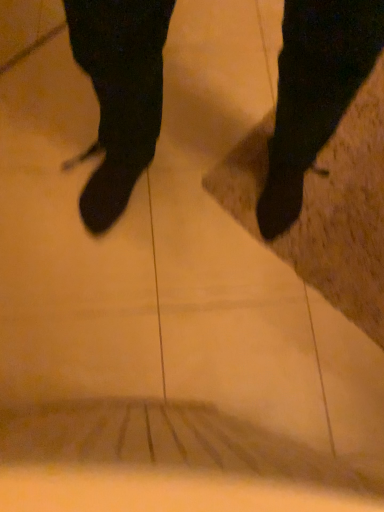
Locate an element on the screen. The width and height of the screenshot is (384, 512). black leather shoe at right is located at coordinates (314, 93).

What do you see at coordinates (314, 93) in the screenshot? This screenshot has width=384, height=512. I see `black leather shoe at right` at bounding box center [314, 93].

The height and width of the screenshot is (512, 384). What are the coordinates of `black leather shoe at right` in the screenshot? It's located at (314, 93).